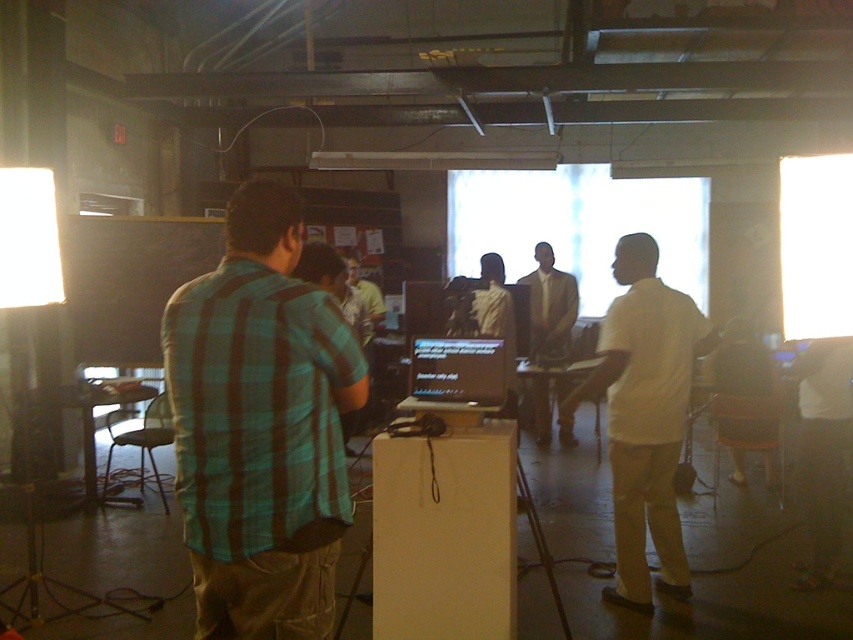
You are a photographer positioned at the back of the room. You want to take a photo of the white matte shirt at center and the white matte shirt at right. Which shirt will appear larger in the photo?

The white matte shirt at center will appear larger in the photo because it is closer to the viewer than the white matte shirt at right.

You are a photographer trying to capture a group photo of the people at the table. You notice two individuals wearing a light beige shirt at center and a yellow shirt at center. To ensure both are in frame, where should you position the camera relative to the table?

Position the camera to the left side of the table so that the light beige shirt at center on the right of the yellow shirt at center can be captured alongside the yellow shirt at center in the frame.